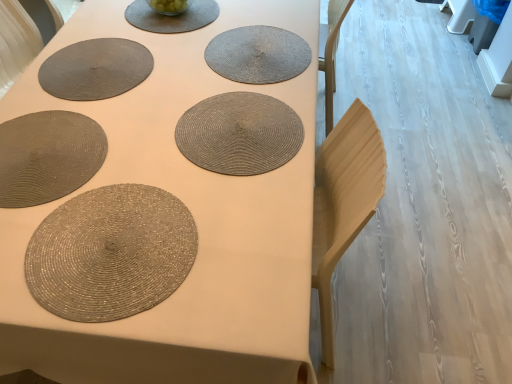
Question: Can you confirm if rattan placemat at center, which appears as the 1th coaster when viewed from the front, is positioned to the left of matte gray placemat at upper center?

Choices:
 (A) no
 (B) yes

Answer: (A)

Question: From the image's perspective, is rattan placemat at center, the second coaster positioned from the back, located above matte gray placemat at upper center?

Choices:
 (A) yes
 (B) no

Answer: (B)

Question: Is matte gray placemat at upper center at the back of rattan placemat at center, which appears as the 1th coaster when viewed from the front?

Choices:
 (A) no
 (B) yes

Answer: (A)

Question: Does rattan placemat at center, which is the 2th coaster in top-to-bottom order, have a lesser height compared to matte gray placemat at upper center?

Choices:
 (A) no
 (B) yes

Answer: (A)

Question: Would you say rattan placemat at center, which appears as the 1th coaster when viewed from the front, is outside matte gray placemat at upper center?

Choices:
 (A) no
 (B) yes

Answer: (B)

Question: Looking at their shapes, would you say rattan placemat at lower left, the second paper plate viewed from the top, is wider or thinner than matte woven placemat at center?

Choices:
 (A) thin
 (B) wide

Answer: (A)

Question: Considering their positions, is rattan placemat at lower left, acting as the 2th paper plate starting from the back, located in front of or behind matte woven placemat at center?

Choices:
 (A) behind
 (B) front

Answer: (A)

Question: Would you say rattan placemat at lower left, the second paper plate viewed from the top, is to the left or to the right of matte woven placemat at center in the picture?

Choices:
 (A) right
 (B) left

Answer: (B)

Question: Looking at the image, does rattan placemat at lower left, which appears as the second paper plate when viewed from the front, seem bigger or smaller compared to matte woven placemat at center?

Choices:
 (A) big
 (B) small

Answer: (B)

Question: Looking at their shapes, would you say matte woven placemat at center is wider or thinner than matte gray placemat at upper center?

Choices:
 (A) wide
 (B) thin

Answer: (A)

Question: From the image's perspective, is matte woven placemat at center above or below matte gray placemat at upper center?

Choices:
 (A) above
 (B) below

Answer: (B)

Question: Considering the relative positions of matte woven placemat at center and matte gray placemat at upper center in the image provided, is matte woven placemat at center to the left or to the right of matte gray placemat at upper center?

Choices:
 (A) left
 (B) right

Answer: (B)

Question: Does point (151, 145) appear closer or farther from the camera than point (202, 9)?

Choices:
 (A) farther
 (B) closer

Answer: (B)

Question: Relative to matte woven placemat at center, is matte gray placemat at upper center in front or behind?

Choices:
 (A) behind
 (B) front

Answer: (A)

Question: Looking at their shapes, would you say matte gray placemat at upper center is wider or thinner than matte woven placemat at center?

Choices:
 (A) wide
 (B) thin

Answer: (B)